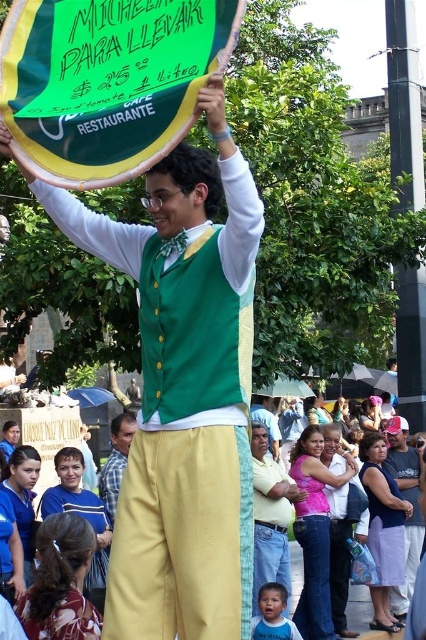
Based on the photo, who is positioned more to the right, denim pants at lower right or pink fabric at center?

denim pants at lower right

Which is below, denim pants at lower right or pink fabric at center?

Positioned lower is denim pants at lower right.

Does point (396, 598) lie behind point (331, 598)?

Yes, point (396, 598) is behind point (331, 598).

Where is `denim pants at lower right`? denim pants at lower right is located at coordinates (408, 500).

Can you confirm if green matte vest at center is bigger than blue plaid shirt at center?

Indeed, green matte vest at center has a larger size compared to blue plaid shirt at center.

What do you see at coordinates (184, 388) in the screenshot? The height and width of the screenshot is (640, 426). I see `green matte vest at center` at bounding box center [184, 388].

I want to click on green matte vest at center, so click(x=184, y=388).

Does purple satin dress at lower center appear on the right side of smooth blue shirt at lower center?

Yes, purple satin dress at lower center is to the right of smooth blue shirt at lower center.

Can you confirm if purple satin dress at lower center is bigger than smooth blue shirt at lower center?

Indeed, purple satin dress at lower center has a larger size compared to smooth blue shirt at lower center.

Does point (386, 580) lie in front of point (262, 618)?

No, it is not.

The image size is (426, 640). Find the location of `purple satin dress at lower center`. purple satin dress at lower center is located at coordinates (385, 531).